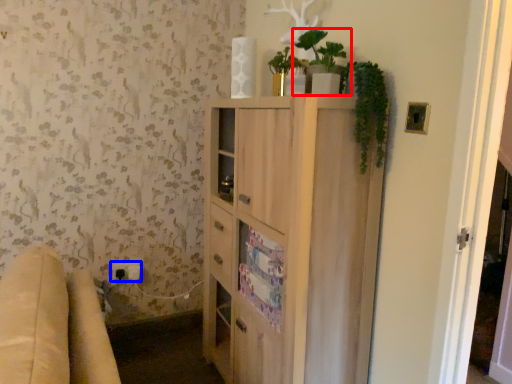
Question: Which point is closer to the camera, houseplant (highlighted by a red box) or electric outlet (highlighted by a blue box)?

Choices:
 (A) houseplant
 (B) electric outlet

Answer: (A)